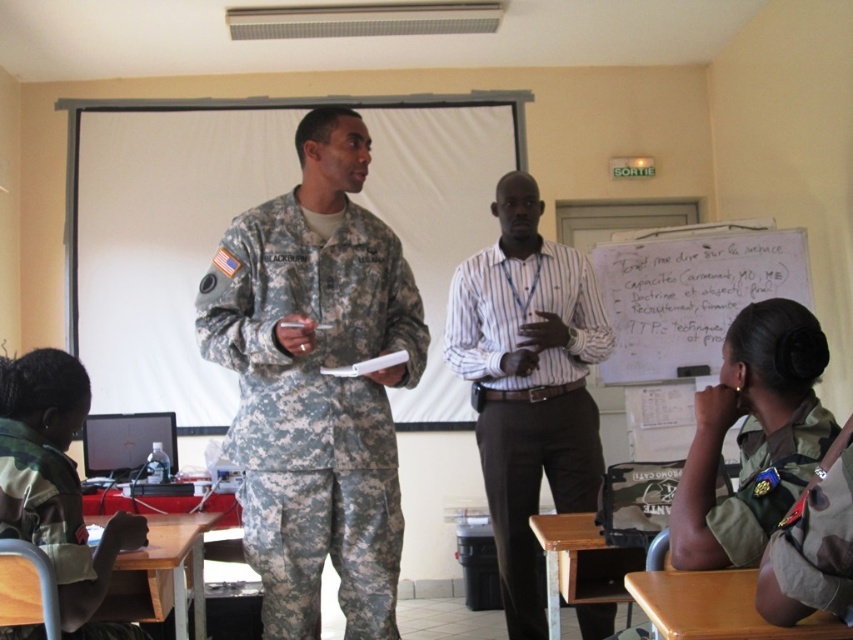
Question: Can you confirm if camouflage uniform at lower left is smaller than camouflage fabric uniform at lower right?

Choices:
 (A) no
 (B) yes

Answer: (A)

Question: Considering the real-world distances, which object is farthest from the striped cotton shirt at center?

Choices:
 (A) camouflage fabric uniform at lower right
 (B) camouflage uniform at lower left

Answer: (B)

Question: Which object appears farthest from the camera in this image?

Choices:
 (A) camouflage uniform at center
 (B) camouflage uniform at lower left

Answer: (A)

Question: Can you confirm if striped cotton shirt at center is thinner than camouflage uniform at lower left?

Choices:
 (A) yes
 (B) no

Answer: (B)

Question: Estimate the real-world distances between objects in this image. Which object is farther from the striped cotton shirt at center?

Choices:
 (A) whiteboard at right
 (B) camouflage uniform at center
 (C) camouflage fabric uniform at lower right
 (D) camouflage uniform at lower left

Answer: (D)

Question: Does camouflage uniform at center have a lesser width compared to striped cotton shirt at center?

Choices:
 (A) yes
 (B) no

Answer: (B)